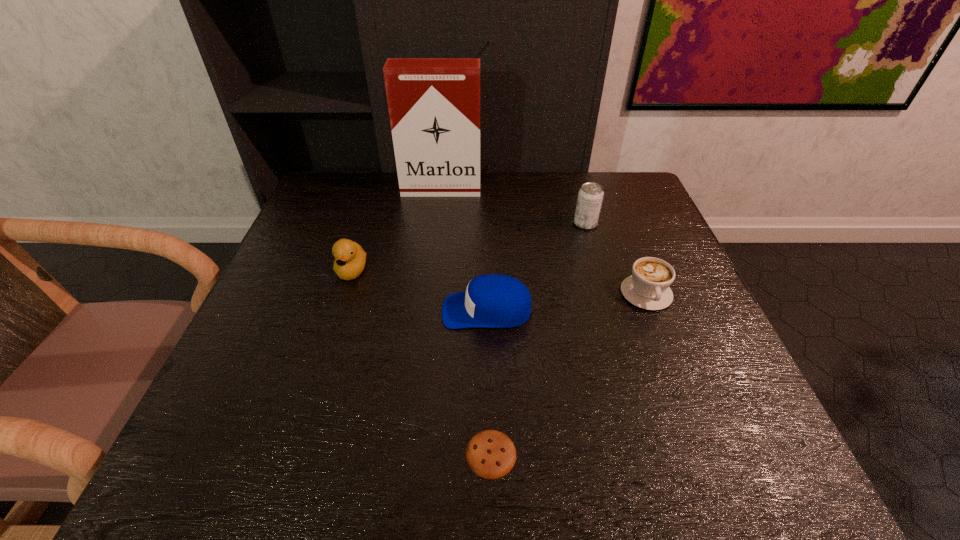
What are the coordinates of `vacant space located on the left of the fifth object from left to right` in the screenshot? It's located at (427, 224).

I want to click on vacant area located on the face of the leftmost object, so click(x=297, y=447).

Identify the location of vacant space located on the front-facing side of the baseball cap. (414, 310).

Locate an element on the screen. The height and width of the screenshot is (540, 960). blank space located on the front-facing side of the baseball cap is located at coordinates (366, 310).

The height and width of the screenshot is (540, 960). Find the location of `free space located 0.360m on the front-facing side of the baseball cap`. free space located 0.360m on the front-facing side of the baseball cap is located at coordinates (271, 310).

Where is `vacant position located to the right of the cappuccino's handle`? vacant position located to the right of the cappuccino's handle is located at coordinates (689, 403).

You are a GUI agent. You are given a task and a screenshot of the screen. Output one action in this format:
    pyautogui.click(x=<x>, y=<y>)
    Task: Click on the free location located on the right of the nearest object
    The image size is (960, 540).
    Given the screenshot: What is the action you would take?
    pyautogui.click(x=561, y=454)

Locate an element on the screen. cigarette_case present at the far edge is located at coordinates (434, 103).

Where is `soda can located at the far edge`? Image resolution: width=960 pixels, height=540 pixels. soda can located at the far edge is located at coordinates (590, 197).

Identify the location of object present at the near edge. The image size is (960, 540). (490, 454).